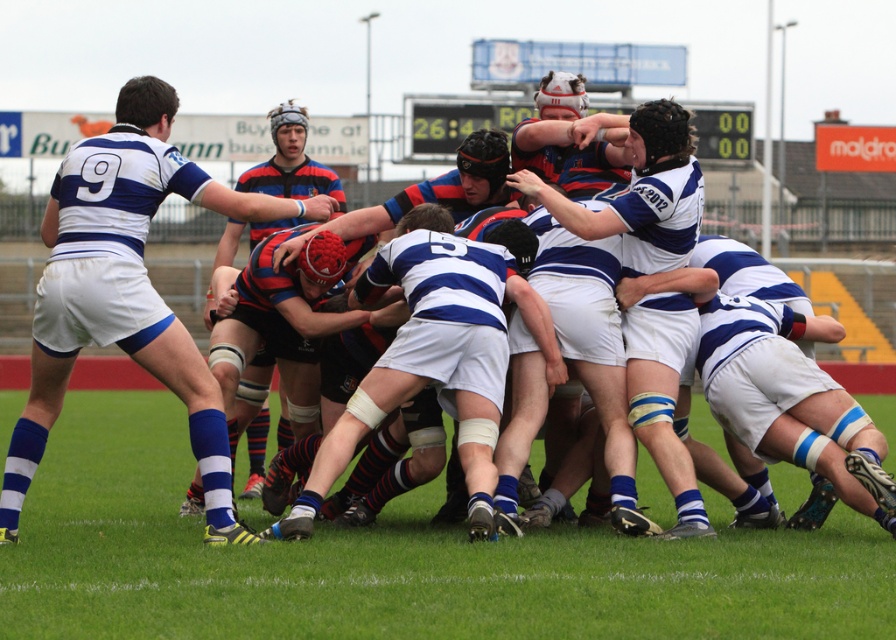
You are a referee observing the scrum. You notice two players wearing the white matte jersey at center and the striped jersey at center. Which player is positioned to the right side of the other?

The white matte jersey at center is to the right of striped jersey at center, so the player in the white matte jersey at center is positioned to the right of the striped jersey at center.

You are a photographer standing at the camera position. You want to take a photo of the rugby scrum. The focus point of your camera is set to 9.90 meters. Will the point at coordinates point (56, 221) be in focus?

The point at coordinates point (56, 221) is 9.90 meters away from the camera, so yes, it will be in focus since the focus point is set to exactly that distance.

You are a referee observing a rugby scrum. You notice two players wearing the white matte jersey at center and the striped jersey at center. Which player is positioned lower in the scrum formation?

The white matte jersey at center is positioned below the striped jersey at center in the scrum formation.